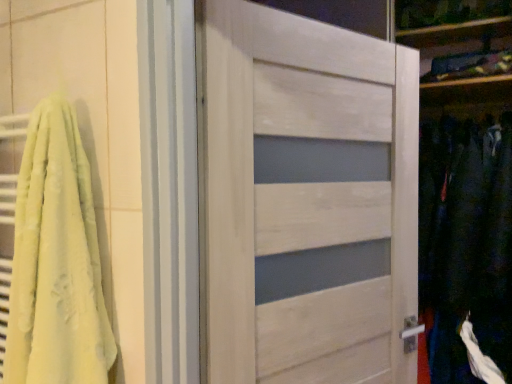
What is the approximate height of white wood door at center?

white wood door at center is 3.84 feet tall.

Describe the element at coordinates (56, 261) in the screenshot. This screenshot has height=384, width=512. I see `soft yellow towel at left` at that location.

Identify the location of dark blue fabric at right. This screenshot has height=384, width=512. (466, 245).

Between white wood door at center and soft yellow towel at left, which one appears on the left side from the viewer's perspective?

soft yellow towel at left is more to the left.

Is white wood door at center not near soft yellow towel at left?

They are positioned close to each other.

Is point (365, 41) in front of point (39, 199)?

No, (365, 41) is behind (39, 199).

What are the coordinates of `clothing on the right of white wood door at center` in the screenshot? It's located at (466, 245).

Is dark blue fabric at right thinner than white wood door at center?

In fact, dark blue fabric at right might be wider than white wood door at center.

Which of these two, dark blue fabric at right or white wood door at center, stands shorter?

white wood door at center.

Is dark blue fabric at right far from white wood door at center?

No, dark blue fabric at right is not far away from white wood door at center.

Is white wood door at center behind dark blue fabric at right?

No.

Is dark blue fabric at right at the back of white wood door at center?

No.

Find the location of a particular element. This screenshot has height=384, width=512. door above the dark blue fabric at right (from a real-world perspective) is located at coordinates (308, 200).

From the image's perspective, is soft yellow towel at left located above or below dark blue fabric at right?

soft yellow towel at left is situated higher than dark blue fabric at right in the image.

Based on their sizes in the image, would you say soft yellow towel at left is bigger or smaller than dark blue fabric at right?

Considering their sizes, soft yellow towel at left takes up less space than dark blue fabric at right.

From the picture: Is soft yellow towel at left to the left of dark blue fabric at right from the viewer's perspective?

Indeed, soft yellow towel at left is positioned on the left side of dark blue fabric at right.

Does soft yellow towel at left have a greater width compared to dark blue fabric at right?

In fact, soft yellow towel at left might be narrower than dark blue fabric at right.

Could you tell me if dark blue fabric at right is turned towards soft yellow towel at left?

No, dark blue fabric at right is not turned towards soft yellow towel at left.

From the image's perspective, is dark blue fabric at right on soft yellow towel at left?

No, from the image's perspective, dark blue fabric at right is not on top of soft yellow towel at left.

From a real-world perspective, which is physically below, dark blue fabric at right or soft yellow towel at left?

dark blue fabric at right, from a real-world perspective.

Is soft yellow towel at left in front of or behind white wood door at center in the image?

Visually, soft yellow towel at left is located in front of white wood door at center.

From the picture: Are soft yellow towel at left and white wood door at center located far from each other?

No, there isn't a large distance between soft yellow towel at left and white wood door at center.

Is soft yellow towel at left aimed at white wood door at center?

No, soft yellow towel at left is not oriented towards white wood door at center.

From a real-world perspective, between soft yellow towel at left and white wood door at center, who is vertically lower?

soft yellow towel at left is physically lower.

Where is `bath towel below the white wood door at center (from the image's perspective)`? Image resolution: width=512 pixels, height=384 pixels. bath towel below the white wood door at center (from the image's perspective) is located at coordinates point(56,261).

The image size is (512, 384). Identify the location of clothing that appears below the white wood door at center (from a real-world perspective). (466, 245).

When comparing their distances from dark blue fabric at right, does white wood door at center or soft yellow towel at left seem further?

Among the two, soft yellow towel at left is located further to dark blue fabric at right.

Considering their positions, is dark blue fabric at right positioned further to white wood door at center than soft yellow towel at left?

dark blue fabric at right.

Estimate the real-world distances between objects in this image. Which object is further from soft yellow towel at left, white wood door at center or dark blue fabric at right?

The object further to soft yellow towel at left is dark blue fabric at right.

Considering their positions, is soft yellow towel at left positioned further to dark blue fabric at right than white wood door at center?

soft yellow towel at left.

Which object lies nearer to the anchor point soft yellow towel at left, dark blue fabric at right or white wood door at center?

white wood door at center is positioned closer to the anchor soft yellow towel at left.

Which object lies further to the anchor point white wood door at center, soft yellow towel at left or dark blue fabric at right?

Based on the image, dark blue fabric at right appears to be further to white wood door at center.

Locate an element on the screen. This screenshot has width=512, height=384. door between soft yellow towel at left and dark blue fabric at right is located at coordinates (308, 200).